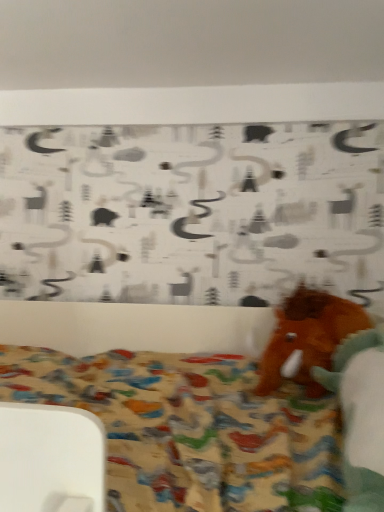
Question: Should I look upward or downward to see brown plush elephant at right?

Choices:
 (A) up
 (B) down

Answer: (B)